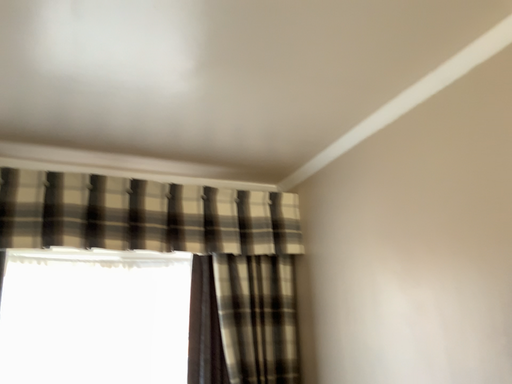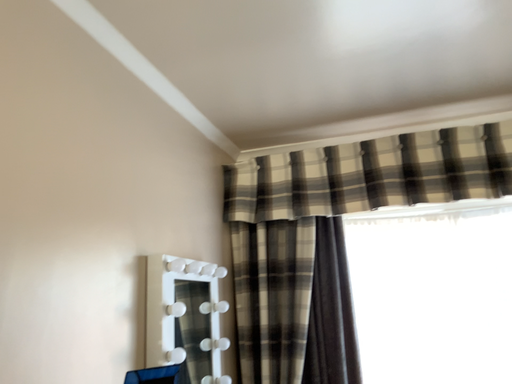
Question: How did the camera likely rotate when shooting the video?

Choices:
 (A) rotated left
 (B) rotated right

Answer: (A)